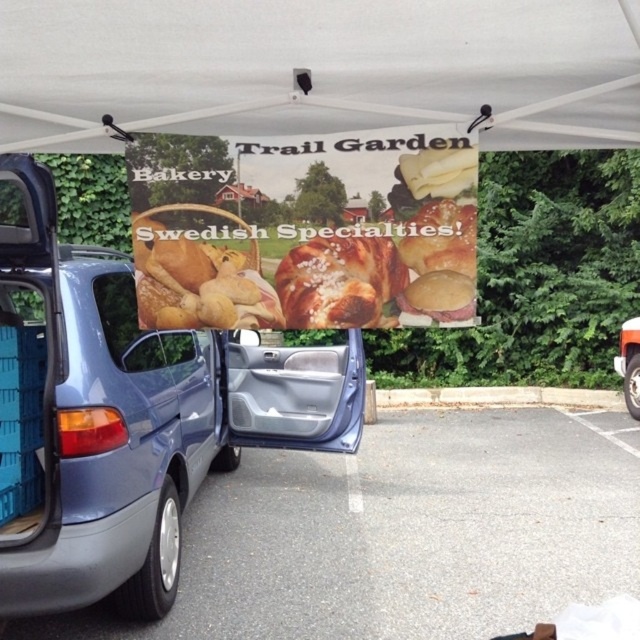
You are standing at the entrance of the canopy tent and want to take a photo of both the banner and the blue minivan. The banner is at point (x=534, y=612) and the minivan is at point (x=218, y=464). Since you want both in focus, which point should you focus on to ensure both are clear?

→ You should focus on point (x=218, y=464) because it is farther from the camera than point (x=534, y=612), so focusing on the farther point will keep both in focus.

You are a delivery driver who needs to load two types of bread into your truck. The breadcrustyatcenter and the golden brown bread at center are both in the van. Which bread has a larger width?

The breadcrustyatcenter has a larger width than the golden brown bread at center.